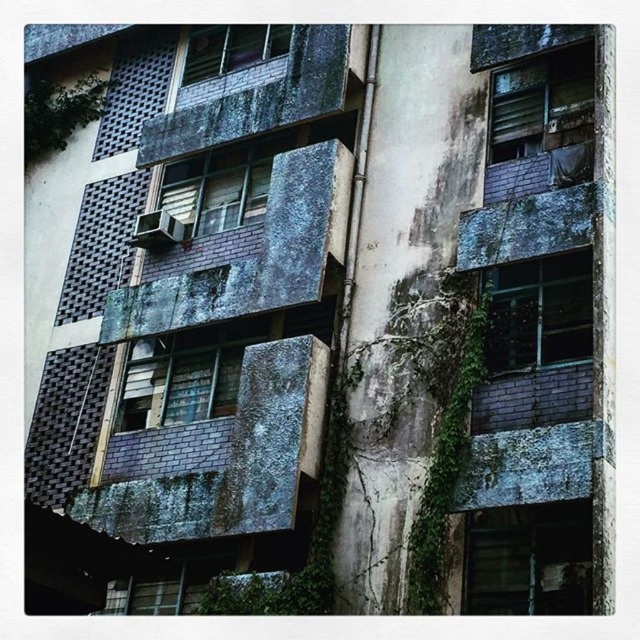
Between matte glass window at upper center and matte gray concrete balcony at upper center, which one has more height?

Standing taller between the two is matte glass window at upper center.

Is matte glass window at upper center closer to the viewer compared to matte gray concrete balcony at upper center?

No, it is not.

Does point (182, 76) come in front of point (134, 234)?

No, it is not.

Where is `matte glass window at upper center`? Image resolution: width=640 pixels, height=640 pixels. matte glass window at upper center is located at coordinates (230, 49).

Does matte glass window at center have a lesser height compared to matte glass window at upper center?

In fact, matte glass window at center may be taller than matte glass window at upper center.

Is matte glass window at center closer to camera compared to matte glass window at upper center?

Yes, it is.

Measure the distance between matte glass window at center and camera.

They are 66.19 feet apart.

The image size is (640, 640). Identify the location of matte glass window at center. [x=221, y=182].

Can you confirm if dark glass window at center right is positioned above matte glass window at center?

Actually, dark glass window at center right is below matte glass window at center.

Does dark glass window at center right have a smaller size compared to matte glass window at center?

Yes, dark glass window at center right is smaller than matte glass window at center.

Which is behind, point (516, 324) or point (214, 148)?

The point (214, 148) is behind.

At what (x,y) coordinates should I click in order to perform the action: click on dark glass window at center right. Please return your answer as a coordinate pair (x, y). Looking at the image, I should click on (538, 312).